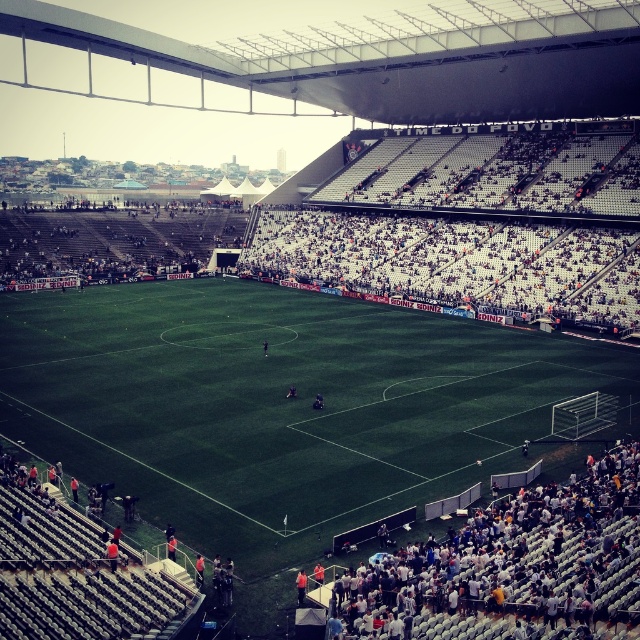
In the scene shown: Can you confirm if green grass football field at center is taller than white fabric crowd at lower right?

Yes, green grass football field at center is taller than white fabric crowd at lower right.

You are a GUI agent. You are given a task and a screenshot of the screen. Output one action in this format:
    pyautogui.click(x=<x>, y=<y>)
    Task: Click on the green grass football field at center
    The width and height of the screenshot is (640, 640).
    Given the screenshot: What is the action you would take?
    pyautogui.click(x=284, y=404)

The image size is (640, 640). Describe the element at coordinates (284, 404) in the screenshot. I see `green grass football field at center` at that location.

The width and height of the screenshot is (640, 640). I want to click on green grass football field at center, so click(x=284, y=404).